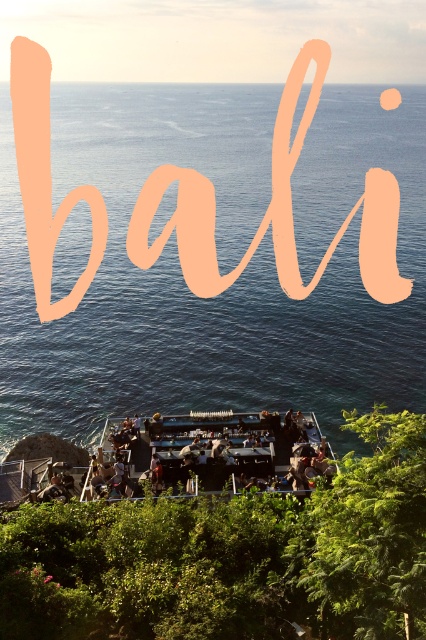
Between blue water at upper center and metallic silver bar at center, which one appears on the left side from the viewer's perspective?

metallic silver bar at center

Identify the location of blue water at upper center. (218, 262).

Locate an element on the screen. blue water at upper center is located at coordinates (218, 262).